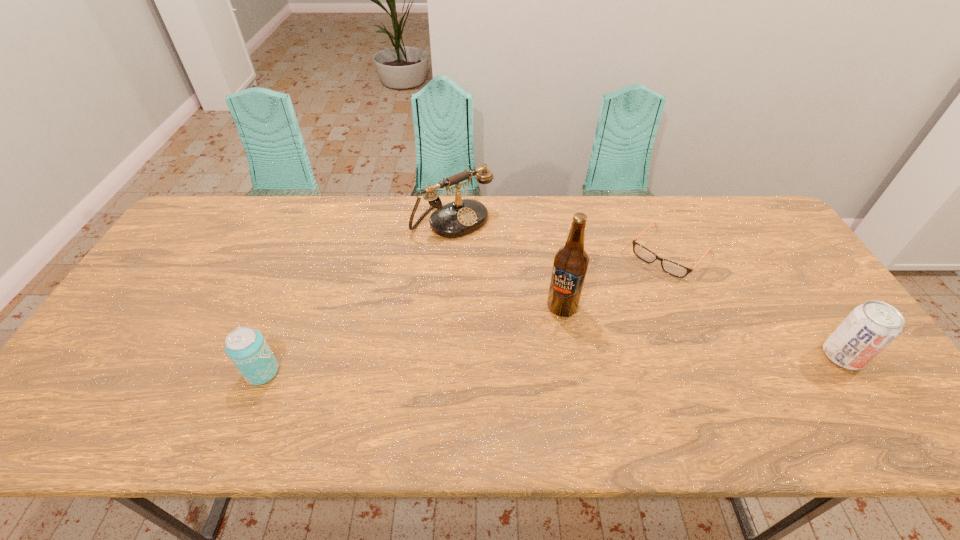
Locate an element on the screen. beer can is located at coordinates [246, 347].

This screenshot has width=960, height=540. I want to click on the fourth tallest object, so click(x=246, y=347).

Locate an element on the screen. The width and height of the screenshot is (960, 540). the rightmost object is located at coordinates (870, 327).

Where is `spectacles`? spectacles is located at coordinates (670, 267).

Where is `the second object from right to left`? the second object from right to left is located at coordinates (670, 267).

Where is `telephone`? telephone is located at coordinates (461, 217).

At what (x,y) coordinates should I click in order to perform the action: click on the tallest object. Please return your answer as a coordinate pair (x, y). The height and width of the screenshot is (540, 960). Looking at the image, I should click on (571, 261).

The width and height of the screenshot is (960, 540). I want to click on the third farthest object, so click(571, 261).

Locate an element on the screen. This screenshot has width=960, height=540. vacant space located on the back of the beer can is located at coordinates (305, 265).

Image resolution: width=960 pixels, height=540 pixels. I want to click on vacant space located on the left of the rightmost object, so click(x=706, y=356).